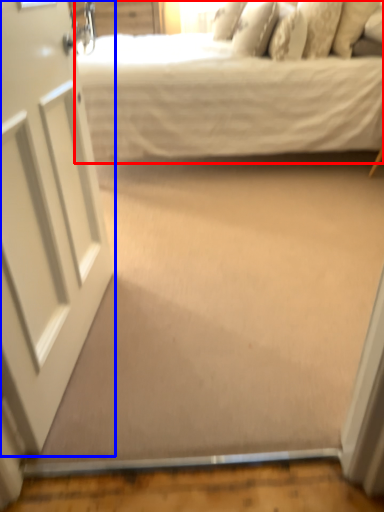
Question: Which point is closer to the camera, bed (highlighted by a red box) or door (highlighted by a blue box)?

Choices:
 (A) bed
 (B) door

Answer: (B)